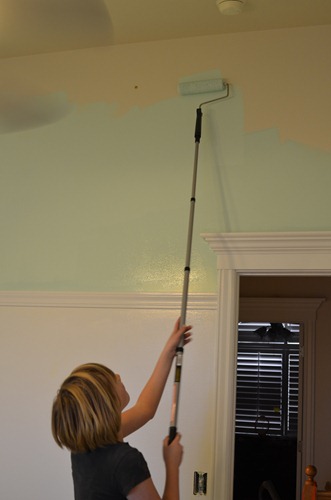
This screenshot has height=500, width=331. What are the coordinates of `light switch` in the screenshot? It's located at (202, 480).